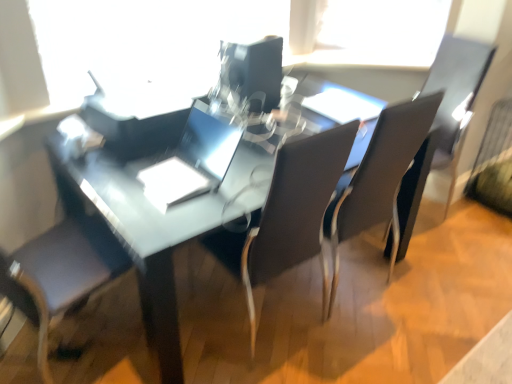
Question: In which direction should I rotate to look at matte black chair at center, arranged as the 2th chair when viewed from the right?

Choices:
 (A) left
 (B) right

Answer: (B)

Question: From a real-world perspective, is matte black chair at center, acting as the 1th chair starting from the right, on matte black armchair at right?

Choices:
 (A) yes
 (B) no

Answer: (A)

Question: From the image's perspective, does matte black chair at center, acting as the 1th chair starting from the right, appear higher than matte black armchair at right?

Choices:
 (A) yes
 (B) no

Answer: (B)

Question: Considering the relative sizes of matte black chair at center, acting as the 1th chair starting from the right, and matte black armchair at right in the image provided, is matte black chair at center, acting as the 1th chair starting from the right, taller than matte black armchair at right?

Choices:
 (A) no
 (B) yes

Answer: (A)

Question: Considering the relative sizes of matte black chair at center, the second chair when ordered from left to right, and matte black armchair at right in the image provided, is matte black chair at center, the second chair when ordered from left to right, bigger than matte black armchair at right?

Choices:
 (A) no
 (B) yes

Answer: (B)

Question: From a real-world perspective, does matte black chair at center, the second chair when ordered from left to right, sit lower than matte black armchair at right?

Choices:
 (A) yes
 (B) no

Answer: (B)

Question: Is matte black chair at center, the second chair when ordered from left to right, oriented away from matte black armchair at right?

Choices:
 (A) yes
 (B) no

Answer: (B)

Question: Can you confirm if transparent plastic window screen at upper center is positioned to the right of sleek silver laptop at center?

Choices:
 (A) yes
 (B) no

Answer: (B)

Question: Are transparent plastic window screen at upper center and sleek silver laptop at center making contact?

Choices:
 (A) no
 (B) yes

Answer: (A)

Question: Is transparent plastic window screen at upper center thinner than sleek silver laptop at center?

Choices:
 (A) no
 (B) yes

Answer: (B)

Question: Does transparent plastic window screen at upper center have a larger size compared to sleek silver laptop at center?

Choices:
 (A) yes
 (B) no

Answer: (A)

Question: From a real-world perspective, does transparent plastic window screen at upper center sit lower than sleek silver laptop at center?

Choices:
 (A) yes
 (B) no

Answer: (B)

Question: Does transparent plastic window screen at upper center have a greater width compared to sleek silver laptop at center?

Choices:
 (A) no
 (B) yes

Answer: (A)

Question: From the image's perspective, would you say glossy plastic computer monitor at center is positioned over matte black armchair at right?

Choices:
 (A) no
 (B) yes

Answer: (B)